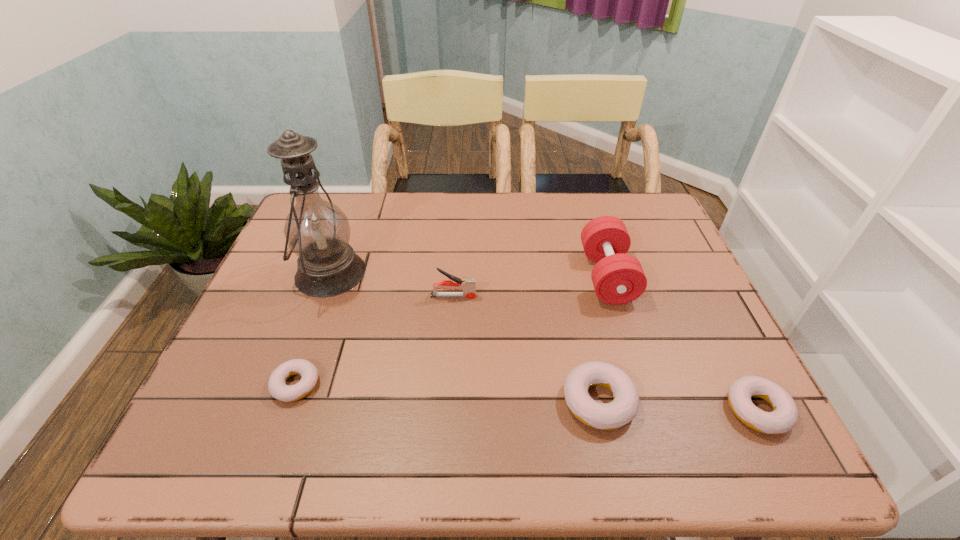
Choose which doughnut is the nearest neighbor to the second doughnut from right to left. Please provide its 2D coordinates. Your answer should be formatted as a tuple, i.e. [(x, y)], where the tuple contains the x and y coordinates of a point satisfying the conditions above.

[(784, 416)]

Find the location of a particular element. The width and height of the screenshot is (960, 540). vacant space that satisfies the following two spatial constraints: 1. on the front side of the second shortest doughnut; 2. on the right side of the dumbbell is located at coordinates (648, 410).

Identify the location of blank space that satisfies the following two spatial constraints: 1. on the back side of the second tallest object; 2. on the left side of the shortest object. The image size is (960, 540). coord(334,276).

Where is `blank space that satisfies the following two spatial constraints: 1. on the back side of the rightmost object; 2. on the handle side of the fourth object from right to left`? blank space that satisfies the following two spatial constraints: 1. on the back side of the rightmost object; 2. on the handle side of the fourth object from right to left is located at coordinates (700, 296).